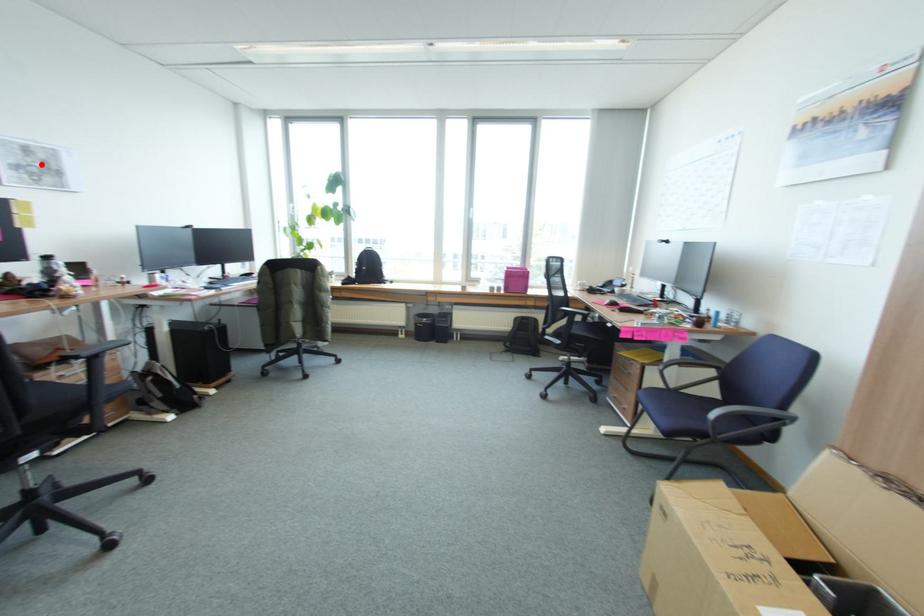
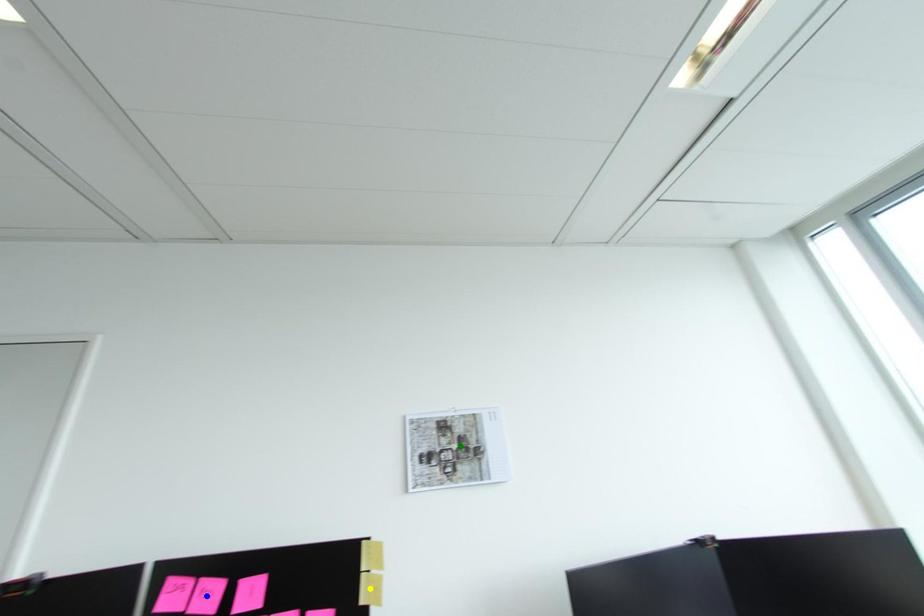
Question: I am providing you with two images of the same scene from different viewpoints. A red point is marked on the first image. You are given multiple points on the second image. Which point in image 2 represents the same 3d spot as the red point in image 1?

Choices:
 (A) yellow point
 (B) blue point
 (C) green point

Answer: (C)